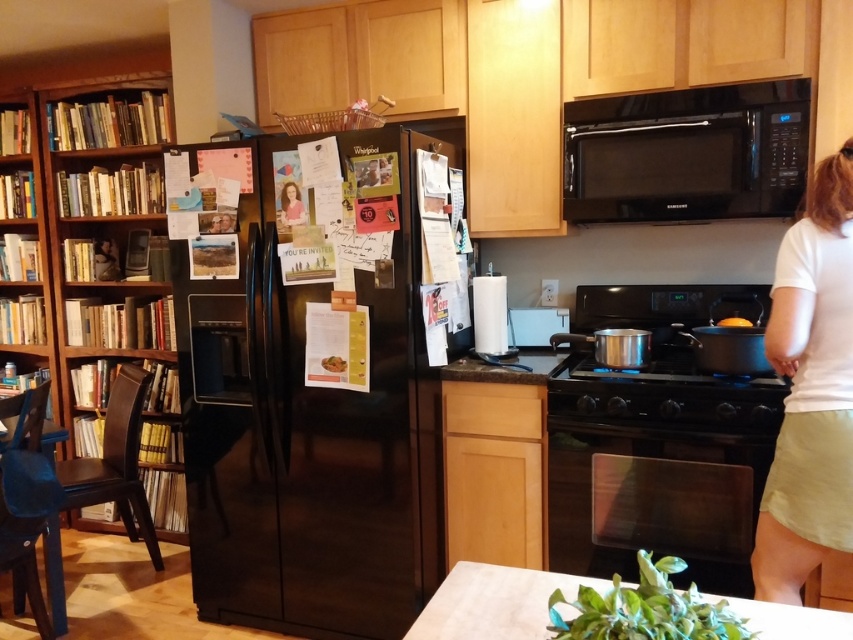
You are standing in the kitchen and see the white cotton shirt at right hanging on a hook. If you need to reach an item on the counter that is 1.2 meters high, can you grab it without moving the shirt?

The white cotton shirt at right is 1.57 meters away from the viewer, so you can reach the item on the counter that is 1.2 meters high without needing to move the shirt since the shirt is farther away than the counter.

Looking at this image, you are standing in the kitchen and want to reach both the point at coordinates (141, 108) and the point at coordinates (643, 198). Which point is closer to you?

The point at coordinates (141, 108) is closer to you because it is further to the camera than point (643, 198).

You are standing in the kitchen and want to grab the white cotton shirt at right and the black glass oven at lower center. Which one can you reach without moving your position?

The white cotton shirt at right is closer to the viewer than the black glass oven at lower center, so you can reach it without moving your position.